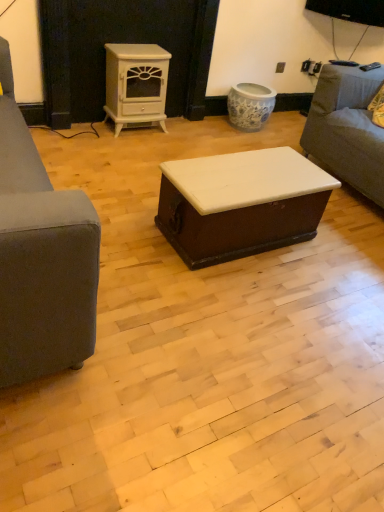
This screenshot has height=512, width=384. I want to click on free spot in front of white glossy wood stove at upper center, so click(137, 142).